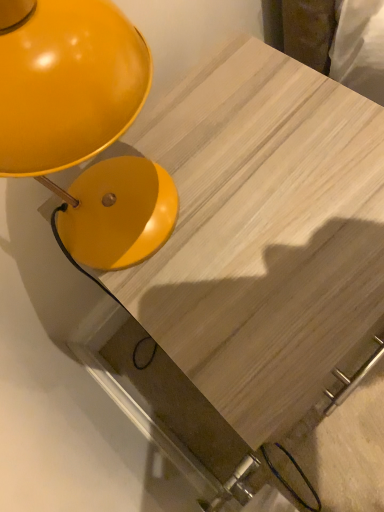
The width and height of the screenshot is (384, 512). In order to click on free area below glossy yellow lamp at upper left (from a real-world perspective) in this screenshot , I will do `click(130, 196)`.